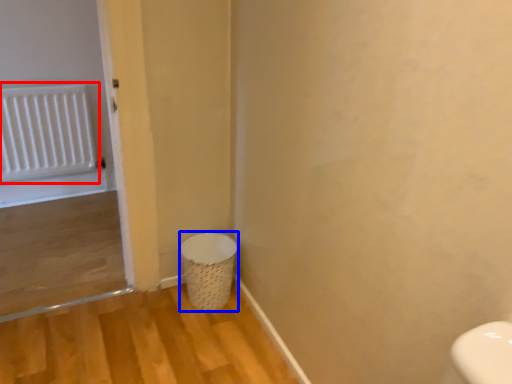
Question: Which object is further to the camera taking this photo, radiator (highlighted by a red box) or laundry basket (highlighted by a blue box)?

Choices:
 (A) radiator
 (B) laundry basket

Answer: (A)